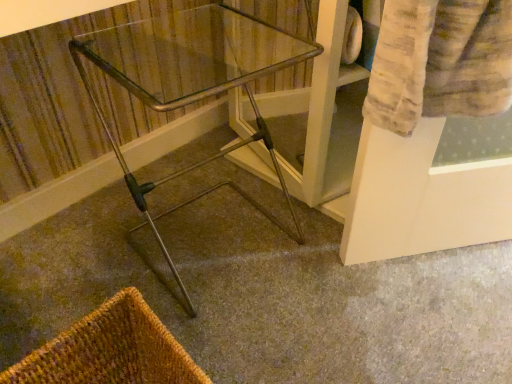
Identify the location of vacant point to the right of clear glass table at center. (328, 264).